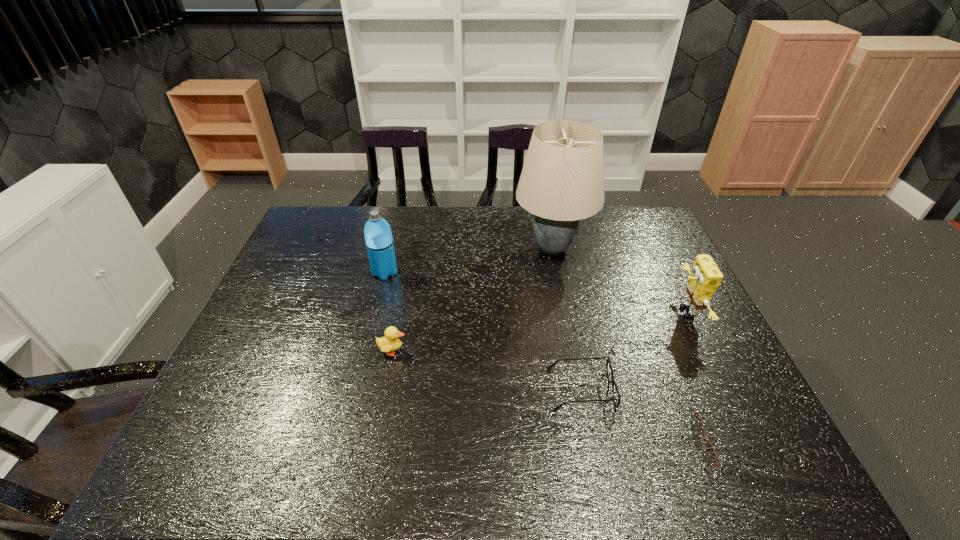
Identify the location of lampshade. The image size is (960, 540). (562, 181).

Find the location of a particular element. The image size is (960, 540). the fifth shortest object is located at coordinates (378, 236).

Identify the location of the third tallest object. The width and height of the screenshot is (960, 540). (705, 278).

Locate an element on the screen. the third farthest object is located at coordinates (705, 278).

I want to click on duckling, so click(390, 342).

The width and height of the screenshot is (960, 540). I want to click on the third shortest object, so click(390, 342).

You are a GUI agent. You are given a task and a screenshot of the screen. Output one action in this format:
    pyautogui.click(x=<x>, y=<y>)
    Task: Click on the second nearest object
    
    Given the screenshot: What is the action you would take?
    pyautogui.click(x=612, y=381)

Locate an element on the screen. Image resolution: width=960 pixels, height=540 pixels. the fifth tallest object is located at coordinates (612, 381).

At what (x,y) coordinates should I click in order to perform the action: click on the shortest object. Please return your answer as a coordinate pair (x, y). Looking at the image, I should click on (698, 422).

Locate an element on the screen. the nearest object is located at coordinates (698, 422).